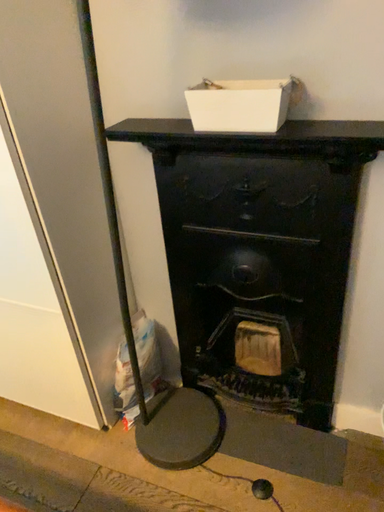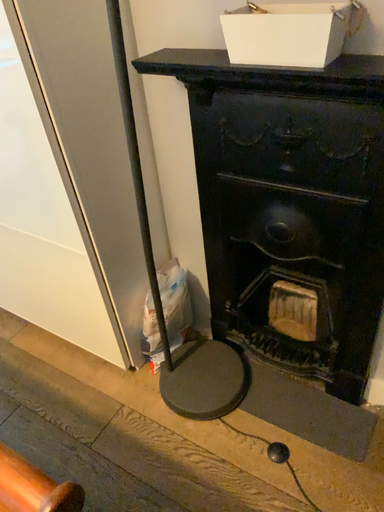
Question: How did the camera likely rotate when shooting the video?

Choices:
 (A) rotated right
 (B) rotated left

Answer: (B)